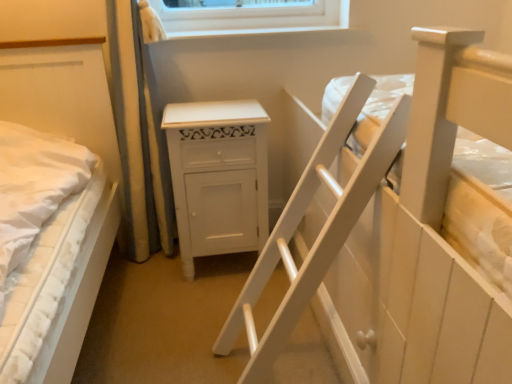
Question: Could you tell me if white textured mattress at left, arranged as the 1th bed when viewed from the left, is turned towards white wooden bed at upper right, the 1th bed viewed from the right?

Choices:
 (A) no
 (B) yes

Answer: (A)

Question: Is white textured mattress at left, arranged as the 1th bed when viewed from the left, at the left side of white wooden bed at upper right, the 1th bed viewed from the right?

Choices:
 (A) yes
 (B) no

Answer: (A)

Question: Is white textured mattress at left, the 2th bed in the right-to-left sequence, not inside white wooden bed at upper right, the 2th bed viewed from the left?

Choices:
 (A) no
 (B) yes

Answer: (B)

Question: From the image's perspective, would you say white textured mattress at left, arranged as the 1th bed when viewed from the left, is positioned over white wooden bed at upper right, the 1th bed viewed from the right?

Choices:
 (A) yes
 (B) no

Answer: (B)

Question: Can you confirm if white textured mattress at left, arranged as the 1th bed when viewed from the left, is thinner than white wooden bed at upper right, the 1th bed viewed from the right?

Choices:
 (A) no
 (B) yes

Answer: (B)

Question: Is white textured mattress at left, the 2th bed in the right-to-left sequence, wider than white wooden bed at upper right, the 2th bed viewed from the left?

Choices:
 (A) no
 (B) yes

Answer: (A)

Question: Could you tell me if white painted wood cabinet at center is facing white textured mattress at left, the 2th bed in the right-to-left sequence?

Choices:
 (A) yes
 (B) no

Answer: (B)

Question: Does white painted wood cabinet at center have a lesser height compared to white textured mattress at left, the 2th bed in the right-to-left sequence?

Choices:
 (A) yes
 (B) no

Answer: (A)

Question: Considering the relative sizes of white painted wood cabinet at center and white textured mattress at left, arranged as the 1th bed when viewed from the left, in the image provided, is white painted wood cabinet at center wider than white textured mattress at left, arranged as the 1th bed when viewed from the left,?

Choices:
 (A) no
 (B) yes

Answer: (A)

Question: Is white painted wood cabinet at center behind white textured mattress at left, the 2th bed in the right-to-left sequence?

Choices:
 (A) no
 (B) yes

Answer: (B)

Question: Can white textured mattress at left, arranged as the 1th bed when viewed from the left, be found inside white painted wood cabinet at center?

Choices:
 (A) no
 (B) yes

Answer: (A)

Question: Is white painted wood cabinet at center facing away from white textured mattress at left, arranged as the 1th bed when viewed from the left?

Choices:
 (A) yes
 (B) no

Answer: (B)

Question: From a real-world perspective, is white wooden bed at upper right, the 1th bed viewed from the right, located beneath white painted wood cabinet at center?

Choices:
 (A) no
 (B) yes

Answer: (A)